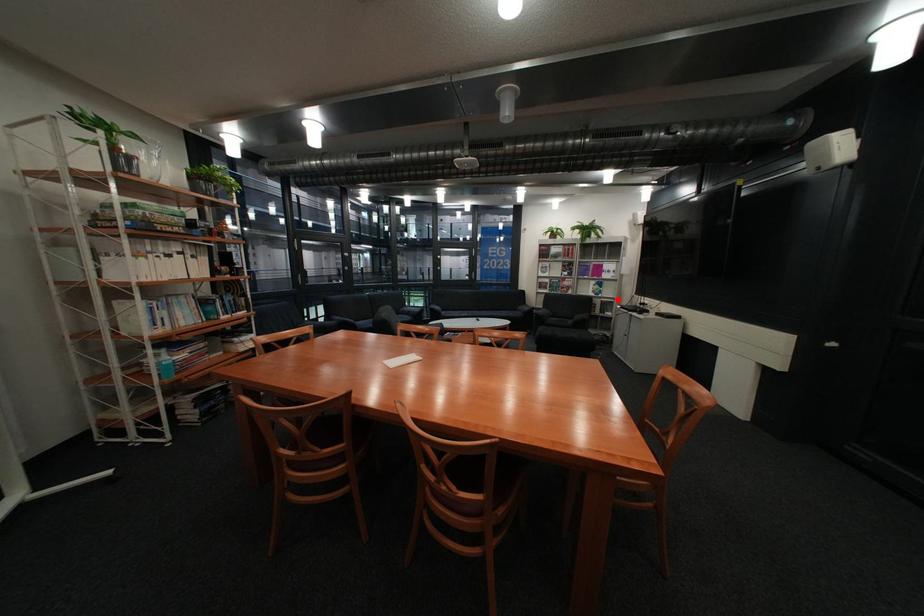
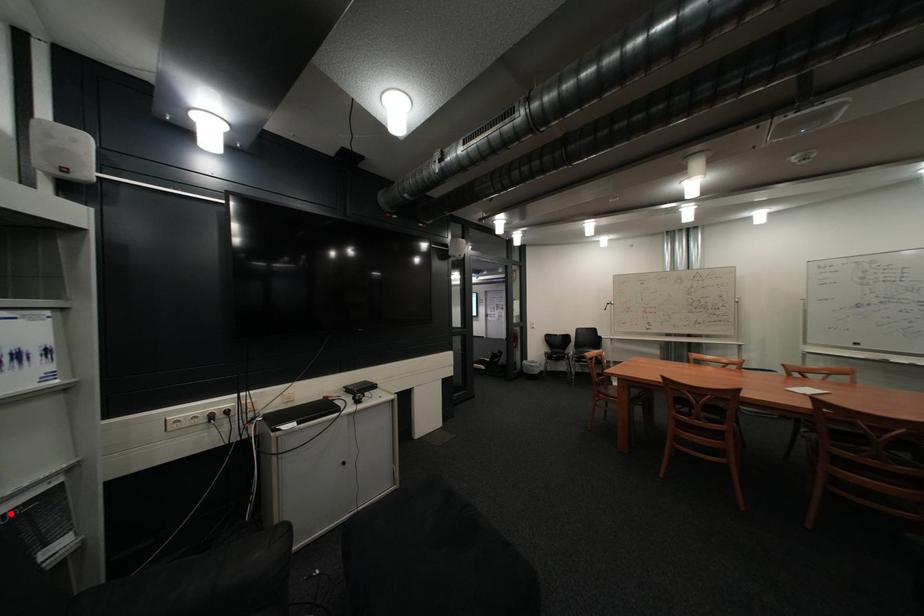
I am providing you with two images of the same scene from different viewpoints. A red point is marked on the first image and another point is marked on the second image. Do the highlighted points in image1 and image2 indicate the same real-world spot?

Yes